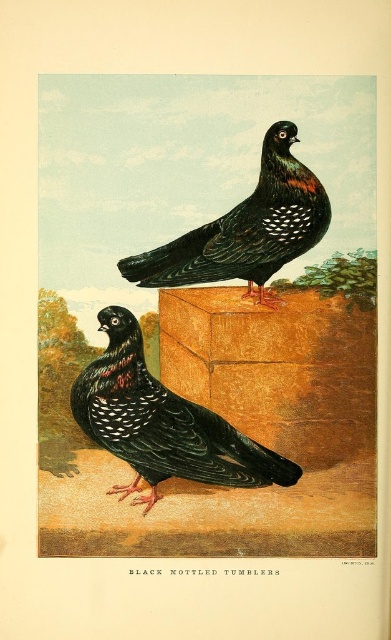
Question: Which object is positioned closest to the black glossy tumbler at upper center?

Choices:
 (A) black speckled pigeon at center
 (B) black speckled pigeon at upper center

Answer: (A)

Question: Is black speckled pigeon at center positioned behind black speckled pigeon at upper center?

Choices:
 (A) yes
 (B) no

Answer: (A)

Question: Among these points, which one is nearest to the camera?

Choices:
 (A) (107, 397)
 (B) (297, 227)
 (C) (215, 385)

Answer: (A)

Question: Is black glossy tumbler at upper center above black speckled pigeon at upper center?

Choices:
 (A) no
 (B) yes

Answer: (A)

Question: Does black glossy tumbler at upper center appear over black speckled pigeon at upper center?

Choices:
 (A) yes
 (B) no

Answer: (B)

Question: Which object is closer to the camera taking this photo?

Choices:
 (A) black speckled pigeon at upper center
 (B) black speckled pigeon at center

Answer: (A)